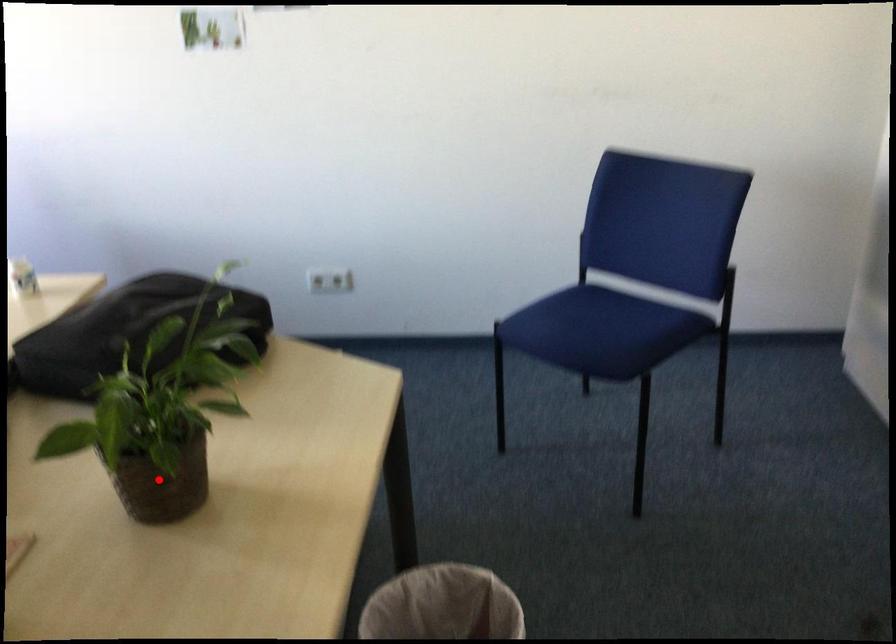
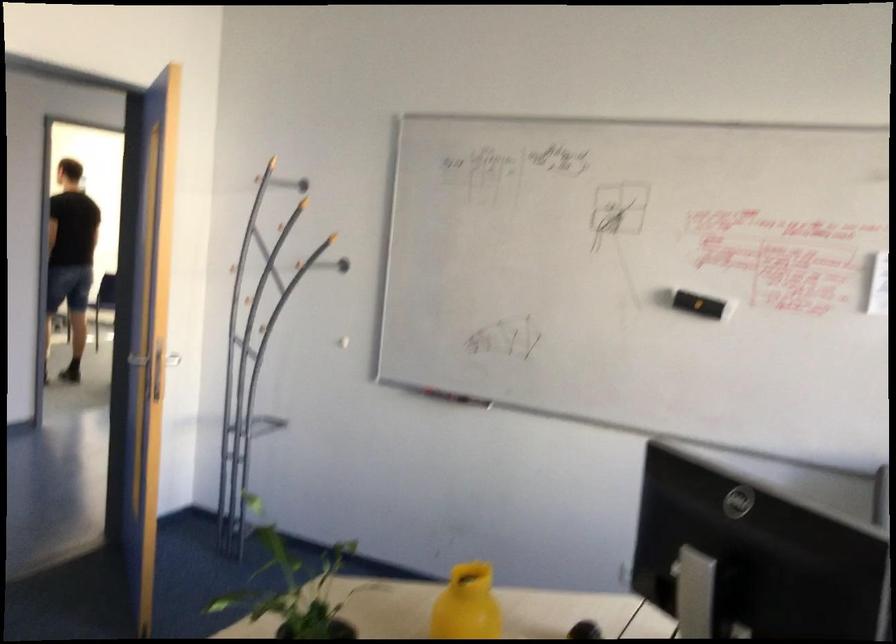
Where in the second image is the point corresponding to the highlighted location from the first image?

(294, 589)